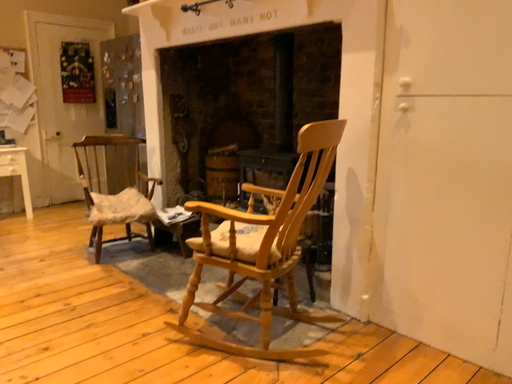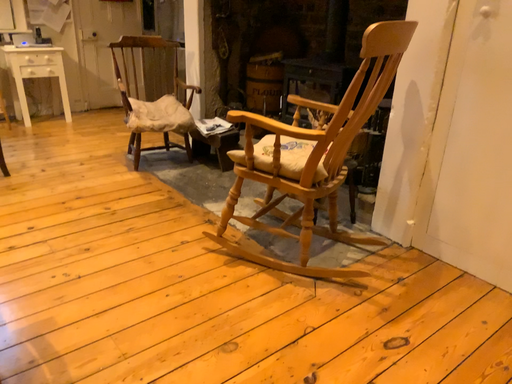
Question: Which way did the camera rotate in the video?

Choices:
 (A) rotated upward
 (B) rotated downward

Answer: (B)